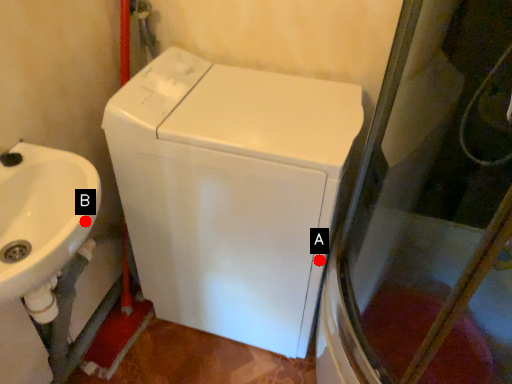
Question: Two points are circled on the image, labeled by A and B beside each circle. Which of the following is the farthest from the observer?

Choices:
 (A) A is further
 (B) B is further

Answer: (A)